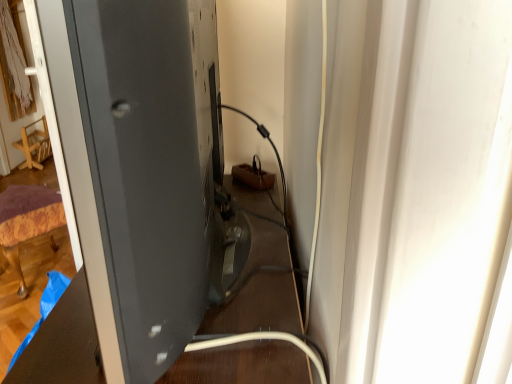
Question: Does point (118, 264) appear closer or farther from the camera than point (3, 269)?

Choices:
 (A) closer
 (B) farther

Answer: (A)

Question: Relative to velvet purple ottoman at lower left, positioned as the first furniture in bottom-to-top order, is matte black monitor at left in front or behind?

Choices:
 (A) behind
 (B) front

Answer: (B)

Question: Based on their relative distances, which object is farther from the velvet purple ottoman at lower left, which is counted as the second furniture, starting from the back?

Choices:
 (A) wooden chair at left, the 2th furniture viewed from the front
 (B) black glossy table at center
 (C) matte black monitor at left

Answer: (A)

Question: Considering the real-world distances, which object is farthest from the wooden chair at left, the 2th furniture viewed from the front?

Choices:
 (A) velvet purple ottoman at lower left, placed as the first furniture when sorted from front to back
 (B) matte black monitor at left
 (C) black glossy table at center

Answer: (B)